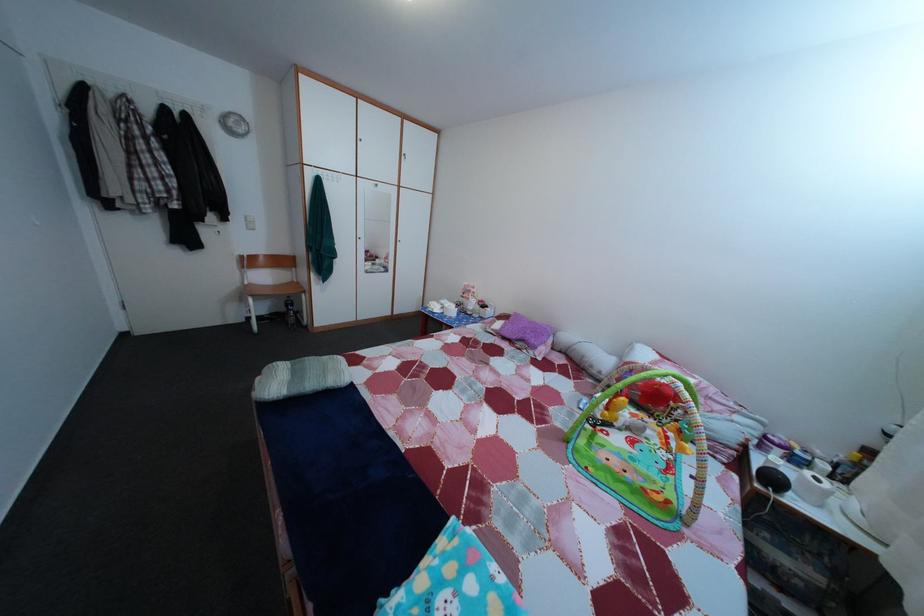
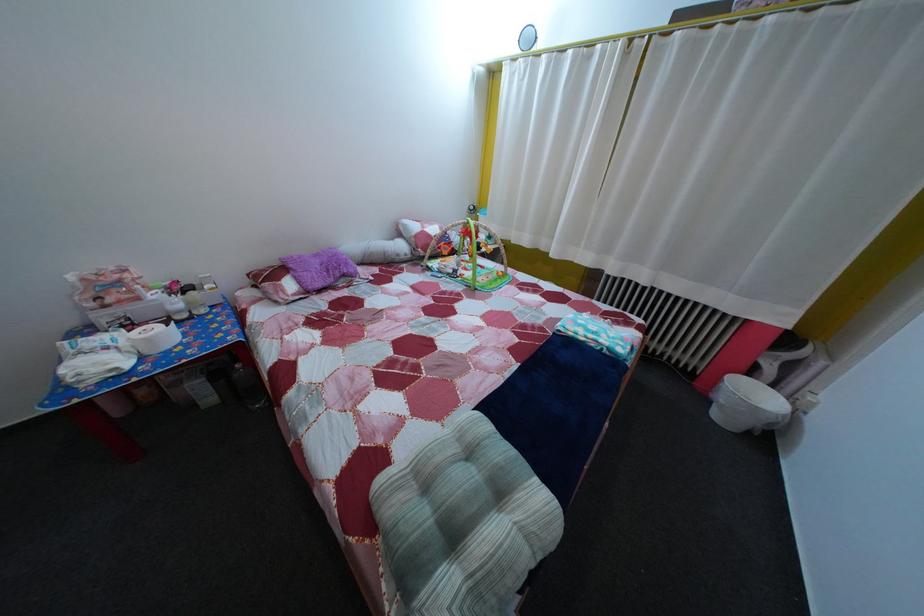
Find the pixel in the second image that matches pixel 373 389 in the first image.

(442, 432)